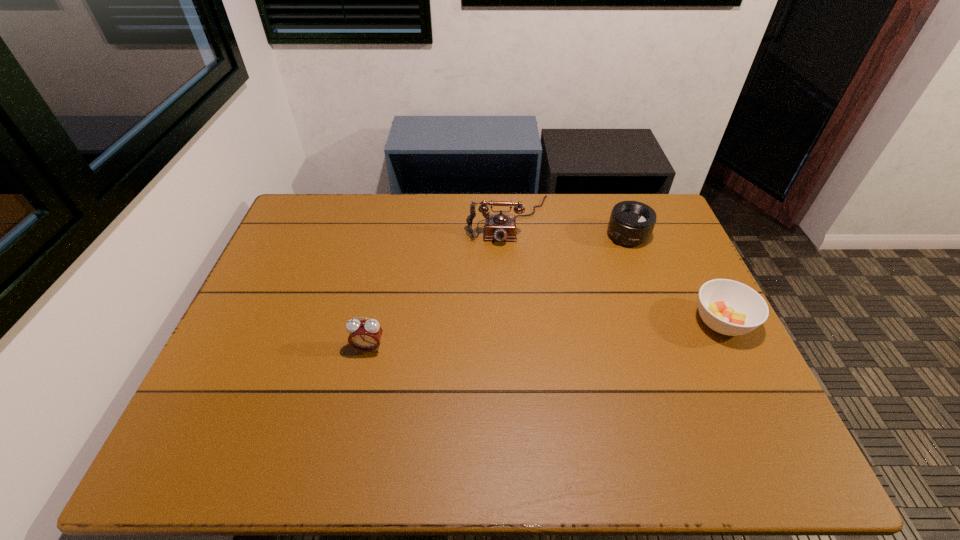
What are the coordinates of `vacant space on the desktop that is between the alarm clock and the soup bowl and is positioned on the dial of the telephone` in the screenshot? It's located at (512, 338).

Where is `free space on the desktop that is between the leftmost object and the rightmost object and is positioned on the side of the third object from left to right with brand markings and control switches`? The image size is (960, 540). free space on the desktop that is between the leftmost object and the rightmost object and is positioned on the side of the third object from left to right with brand markings and control switches is located at coordinates (531, 336).